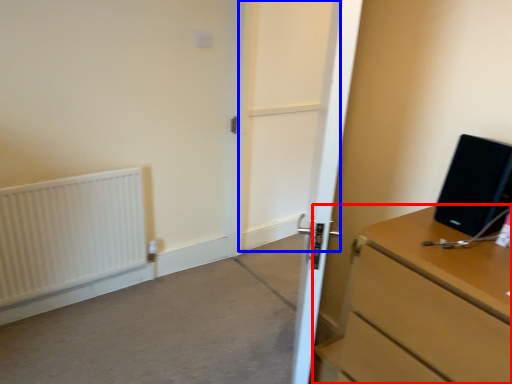
Question: Among these objects, which one is nearest to the camera, chest of drawers (highlighted by a red box) or screen door (highlighted by a blue box)?

Choices:
 (A) chest of drawers
 (B) screen door

Answer: (A)